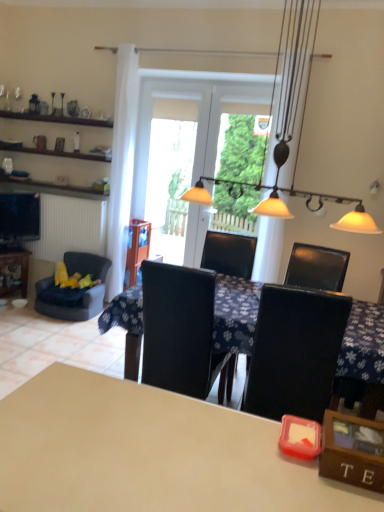
This screenshot has height=512, width=384. In order to click on blank space situated above transparent glass door at center, which is the first screen door from left to right (from a real-world perspective) in this screenshot , I will do `click(187, 80)`.